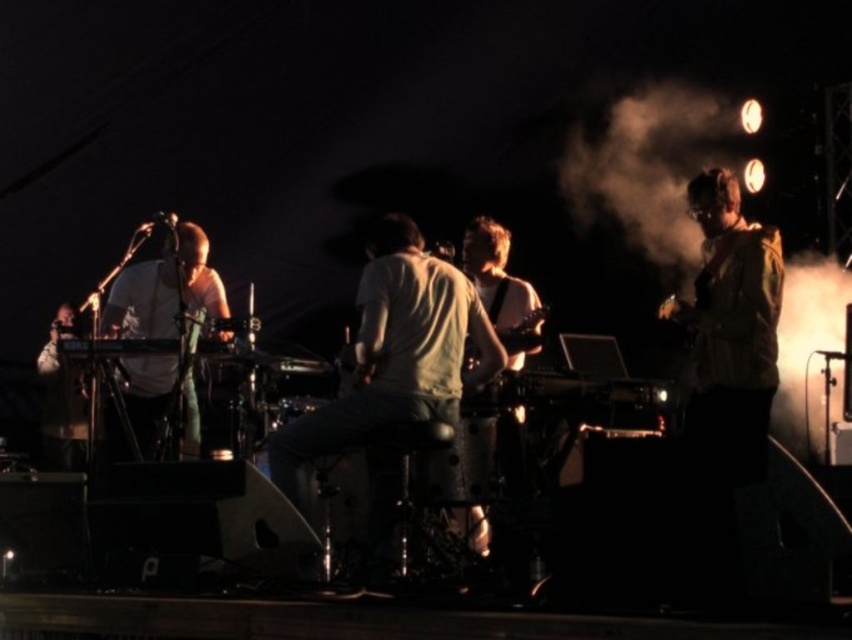
Is white matte shirt at center to the left of white matte keyboard at center from the viewer's perspective?

In fact, white matte shirt at center is to the right of white matte keyboard at center.

Between white matte shirt at center and white matte keyboard at center, which one has less height?

With less height is white matte keyboard at center.

Where is `white matte shirt at center`? The height and width of the screenshot is (640, 852). white matte shirt at center is located at coordinates (393, 356).

Can you confirm if white fog at right is positioned below white matte shirt at center?

No, white fog at right is not below white matte shirt at center.

Does white fog at right have a smaller size compared to white matte shirt at center?

Yes, white fog at right is smaller than white matte shirt at center.

Who is more forward, (649, 252) or (373, 266)?

Point (373, 266) is more forward.

Where is `white fog at right`? white fog at right is located at coordinates (649, 168).

Is white matte keyboard at center bigger than matte white keyboard at left?

No.

Is point (160, 314) positioned after point (58, 442)?

No.

Which is in front, point (147, 445) or point (43, 378)?

Point (147, 445) is more forward.

Locate an element on the screen. white matte keyboard at center is located at coordinates (165, 289).